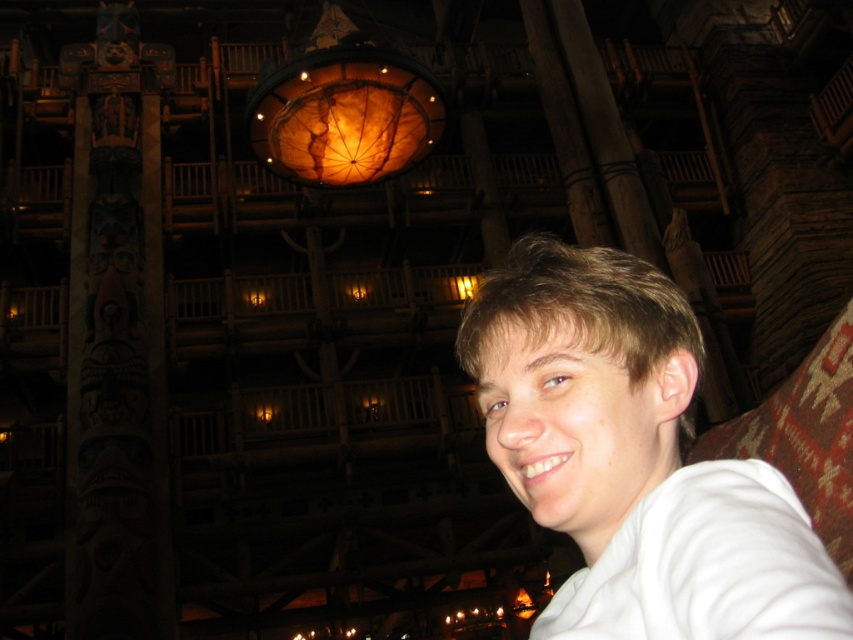
Does white matte shirt at center have a greater width compared to translucent amber glass at center?

In fact, white matte shirt at center might be narrower than translucent amber glass at center.

Can you confirm if white matte shirt at center is shorter than translucent amber glass at center?

Yes.

Which is behind, point (566, 429) or point (318, 164)?

The point (318, 164) is more distant.

You are a GUI agent. You are given a task and a screenshot of the screen. Output one action in this format:
    pyautogui.click(x=<x>, y=<y>)
    Task: Click on the white matte shirt at center
    The height and width of the screenshot is (640, 853).
    Given the screenshot: What is the action you would take?
    pyautogui.click(x=634, y=460)